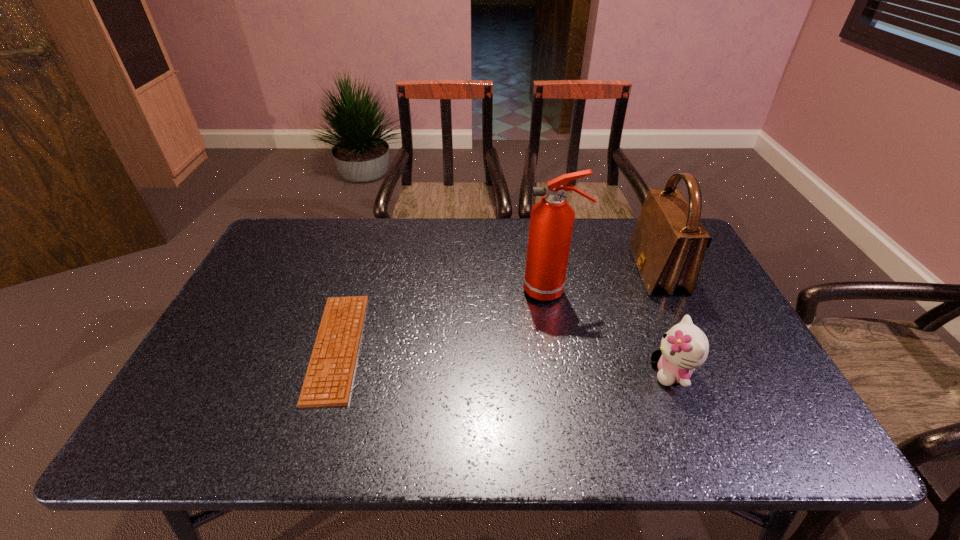
You are a GUI agent. You are given a task and a screenshot of the screen. Output one action in this format:
    pyautogui.click(x=<x>, y=<y>)
    Task: Click on the free space at the left edge
    The width and height of the screenshot is (960, 540).
    Given the screenshot: What is the action you would take?
    pyautogui.click(x=230, y=320)

You are a GUI agent. You are given a task and a screenshot of the screen. Output one action in this format:
    pyautogui.click(x=<x>, y=<y>)
    Task: Click on the free location at the right edge of the desktop
    
    Given the screenshot: What is the action you would take?
    pyautogui.click(x=767, y=408)

In the image, there is a desktop. Where is `vacant space at the near right corner`? This screenshot has height=540, width=960. vacant space at the near right corner is located at coordinates (768, 419).

This screenshot has width=960, height=540. Identify the location of free space between the second shortest object and the shortest object. (505, 360).

Locate an element on the screen. This screenshot has height=540, width=960. free area in between the shoulder bag and the tallest object is located at coordinates (604, 281).

Identify the location of vacant point located between the tallest object and the leftmost object. (444, 319).

Locate an element on the screen. The width and height of the screenshot is (960, 540). empty space that is in between the tallest object and the leftmost object is located at coordinates (444, 319).

This screenshot has width=960, height=540. Find the location of `vacant space that's between the fire extinguisher and the third shortest object`. vacant space that's between the fire extinguisher and the third shortest object is located at coordinates (604, 281).

Find the location of a particular element. free point between the fire extinguisher and the kitten is located at coordinates (612, 331).

Identify the location of free space that is in between the computer keyboard and the third tallest object. (505, 360).